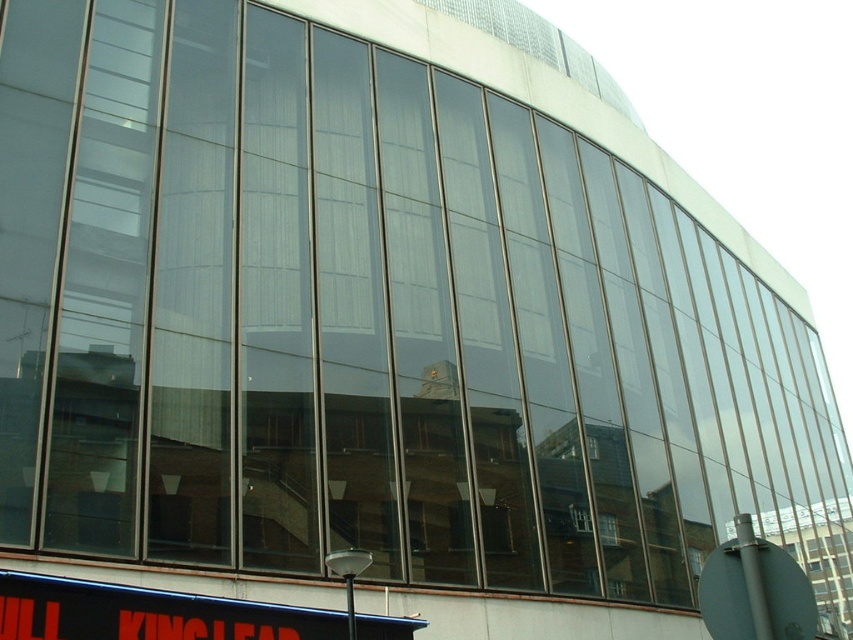
Does black plastic sign at lower left lie behind metallic gray sign at lower right?

Yes, black plastic sign at lower left is behind metallic gray sign at lower right.

Does black plastic sign at lower left come in front of metallic gray sign at lower right?

No, it is behind metallic gray sign at lower right.

Find the location of a particular element. Image resolution: width=853 pixels, height=640 pixels. black plastic sign at lower left is located at coordinates (148, 612).